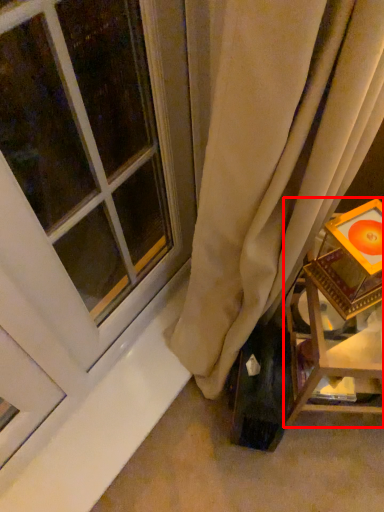
Question: From the image's perspective, what is the correct spatial positioning of furniture (annotated by the red box) in reference to window?

Choices:
 (A) below
 (B) above

Answer: (A)